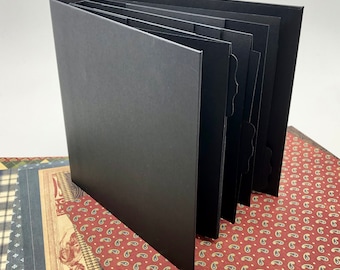
Locate an element on the screen. scrollwork is located at coordinates click(73, 246).